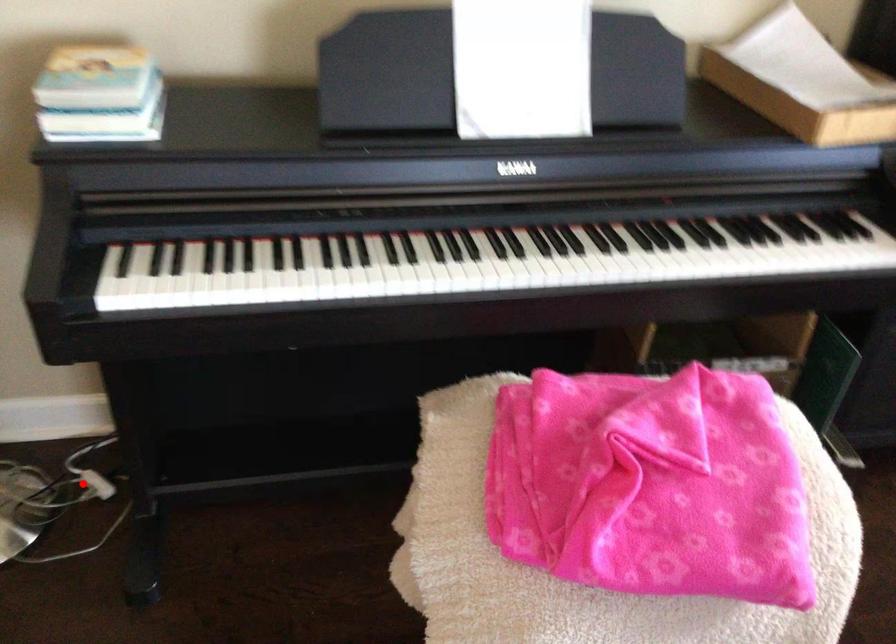
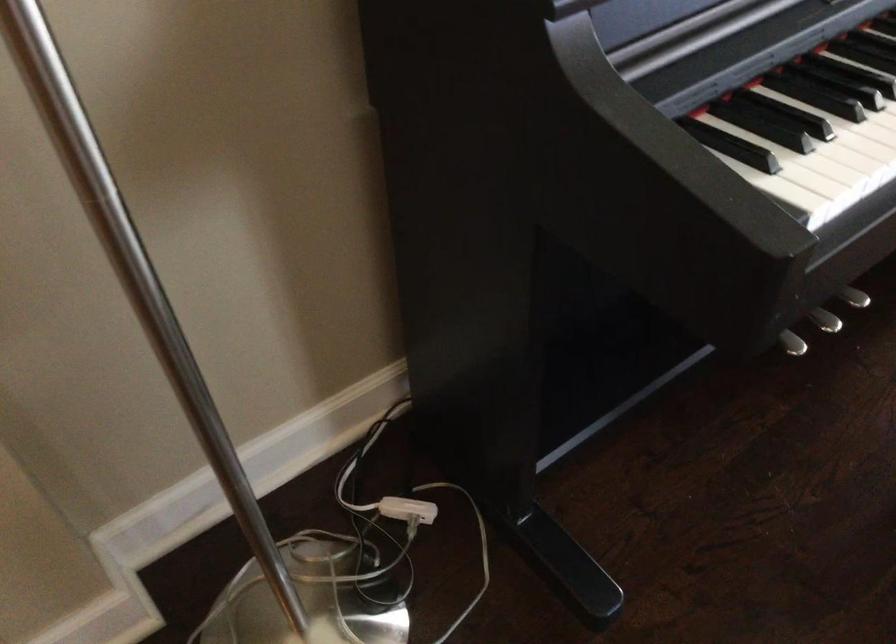
Where in the second image is the point corresponding to the highlighted location from the first image?

(408, 509)